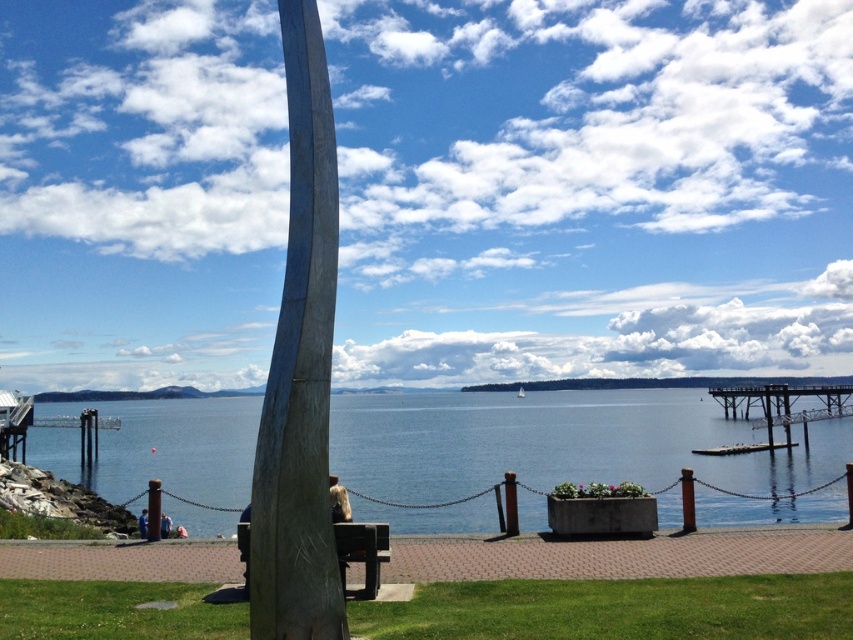
Question: Among these objects, which one is nearest to the camera?

Choices:
 (A) blue water at center
 (B) brushed metal pole at lower left
 (C) blonde hair at lower center
 (D) smooth wood sculpture at center

Answer: (D)

Question: Which object appears closest to the camera in this image?

Choices:
 (A) wooden park bench at center
 (B) blue water at center
 (C) blonde hair at lower center

Answer: (A)

Question: Can you confirm if brushed metal pole at lower left is positioned to the right of blonde hair at lower center?

Choices:
 (A) yes
 (B) no

Answer: (A)

Question: Does blue water at center have a greater width compared to smooth wood sculpture at center?

Choices:
 (A) yes
 (B) no

Answer: (A)

Question: Among these points, which one is nearest to the camera?

Choices:
 (A) (144, 529)
 (B) (332, 500)
 (C) (296, 634)
 (D) (161, 515)

Answer: (C)

Question: Is wooden park bench at center positioned at the back of blue fabric person at lower center?

Choices:
 (A) yes
 (B) no

Answer: (B)